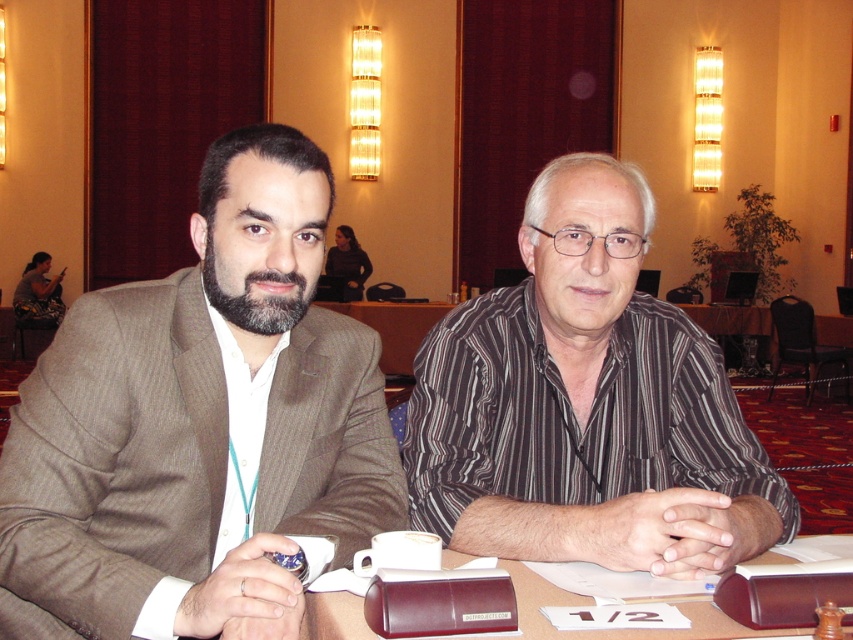
Does striped cotton shirt at center have a smaller size compared to brown leather folder at center?

Incorrect, striped cotton shirt at center is not smaller in size than brown leather folder at center.

Is striped cotton shirt at center bigger than brown leather folder at center?

Correct, striped cotton shirt at center is larger in size than brown leather folder at center.

Which is behind, point (738, 472) or point (705, 600)?

The point (738, 472) is more distant.

You are a GUI agent. You are given a task and a screenshot of the screen. Output one action in this format:
    pyautogui.click(x=<x>, y=<y>)
    Task: Click on the striped cotton shirt at center
    This screenshot has width=853, height=640.
    Given the screenshot: What is the action you would take?
    pyautogui.click(x=585, y=404)

Does brown pinstripe suit at left appear under brown leather folder at center?

No, brown pinstripe suit at left is not below brown leather folder at center.

Which is below, brown pinstripe suit at left or brown leather folder at center?

Positioned lower is brown leather folder at center.

Who is more distant from viewer, (x=106, y=486) or (x=654, y=634)?

The point (x=106, y=486) is behind.

Locate an element on the screen. This screenshot has height=640, width=853. brown pinstripe suit at left is located at coordinates (198, 422).

Can you confirm if brown pinstripe suit at left is positioned below striped cotton shirt at center?

Yes.

Between brown pinstripe suit at left and striped cotton shirt at center, which one has less height?

Standing shorter between the two is striped cotton shirt at center.

You are a GUI agent. You are given a task and a screenshot of the screen. Output one action in this format:
    pyautogui.click(x=<x>, y=<y>)
    Task: Click on the brown pinstripe suit at left
    This screenshot has height=640, width=853.
    Given the screenshot: What is the action you would take?
    pyautogui.click(x=198, y=422)